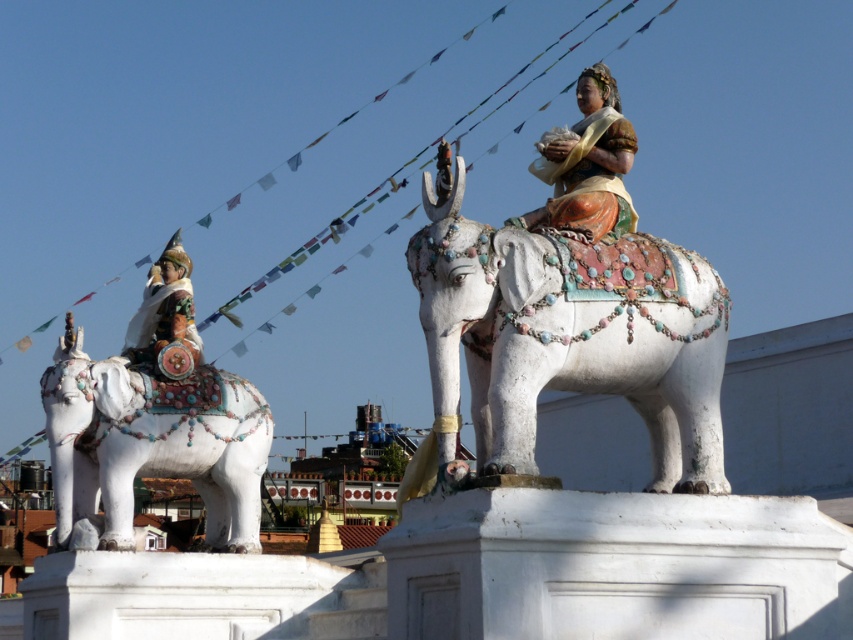
Who is taller, white glossy elephant at center or white glossy elephant at left?

white glossy elephant at center

Is white glossy elephant at center closer to the viewer compared to white glossy elephant at left?

Yes, it is.

Is point (717, 436) positioned after point (50, 397)?

No.

At what (x,y) coordinates should I click in order to perform the action: click on white glossy elephant at center. Please return your answer as a coordinate pair (x, y). The image size is (853, 640). Looking at the image, I should click on (570, 339).

Measure the distance from white glossy elephant at left to polychrome painted statue at upper right.

white glossy elephant at left is 86.05 feet away from polychrome painted statue at upper right.

Between point (190, 452) and point (604, 212), which one is positioned behind?

Positioned behind is point (190, 452).

Is point (218, 502) farther from camera compared to point (605, 92)?

Yes, it is.

Locate an element on the screen. This screenshot has width=853, height=640. white glossy elephant at left is located at coordinates (149, 445).

Is white glossy elephant at center taller than polychrome painted statue at upper right?

Yes, white glossy elephant at center is taller than polychrome painted statue at upper right.

Who is positioned more to the right, white glossy elephant at center or polychrome painted statue at upper right?

Positioned to the right is polychrome painted statue at upper right.

Which is behind, point (601, 301) or point (579, 230)?

Positioned behind is point (579, 230).

I want to click on white glossy elephant at center, so click(570, 339).